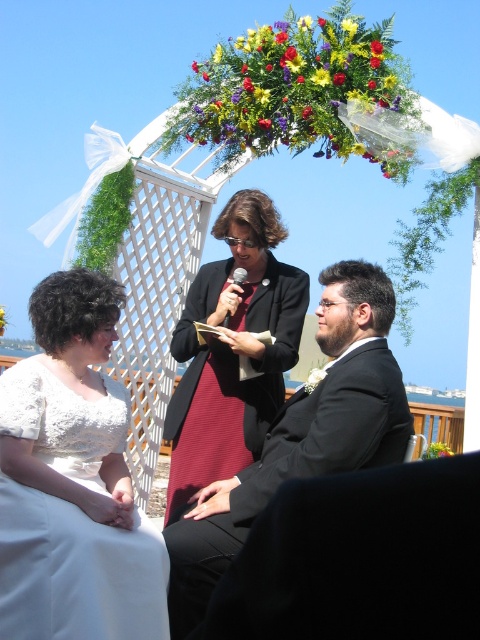
Between white lace dress at lower left and black satin suit at center, which one has less height?

With less height is white lace dress at lower left.

Does point (3, 509) come behind point (336, 355)?

No, (3, 509) is closer to viewer.

What do you see at coordinates (72, 481) in the screenshot? I see `white lace dress at lower left` at bounding box center [72, 481].

This screenshot has width=480, height=640. I want to click on white lace dress at lower left, so click(x=72, y=481).

Does point (269, 432) come in front of point (192, 483)?

Yes, point (269, 432) is in front of point (192, 483).

Is black satin suit at center in front of maroon textured dress at center?

Yes, it is.

Image resolution: width=480 pixels, height=640 pixels. Describe the element at coordinates (301, 435) in the screenshot. I see `black satin suit at center` at that location.

Identify the location of black satin suit at center. The image size is (480, 640). (301, 435).

Can you confirm if black satin suit at center is positioned below black plastic microphone at center?

Yes, black satin suit at center is below black plastic microphone at center.

Can you confirm if black satin suit at center is wider than black plastic microphone at center?

Correct, the width of black satin suit at center exceeds that of black plastic microphone at center.

Measure the distance between black satin suit at center and camera.

black satin suit at center and camera are 34.67 feet apart.

The width and height of the screenshot is (480, 640). In order to click on black satin suit at center in this screenshot , I will do point(301,435).